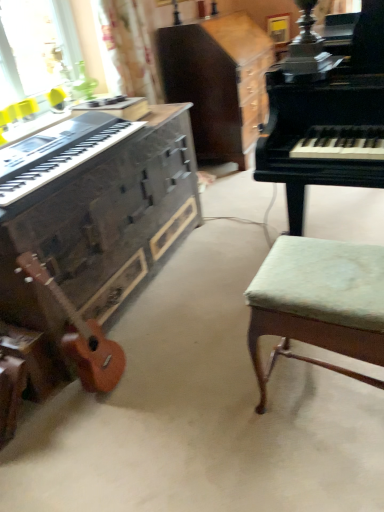
Identify the location of vacant area on top of green fabric stool at right (from a real-world perspective). The height and width of the screenshot is (512, 384). (329, 271).